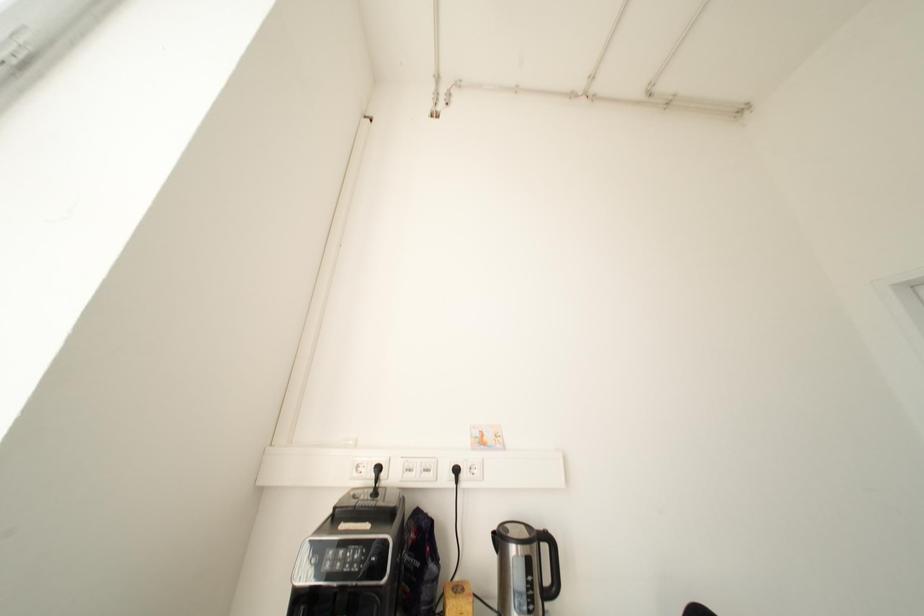
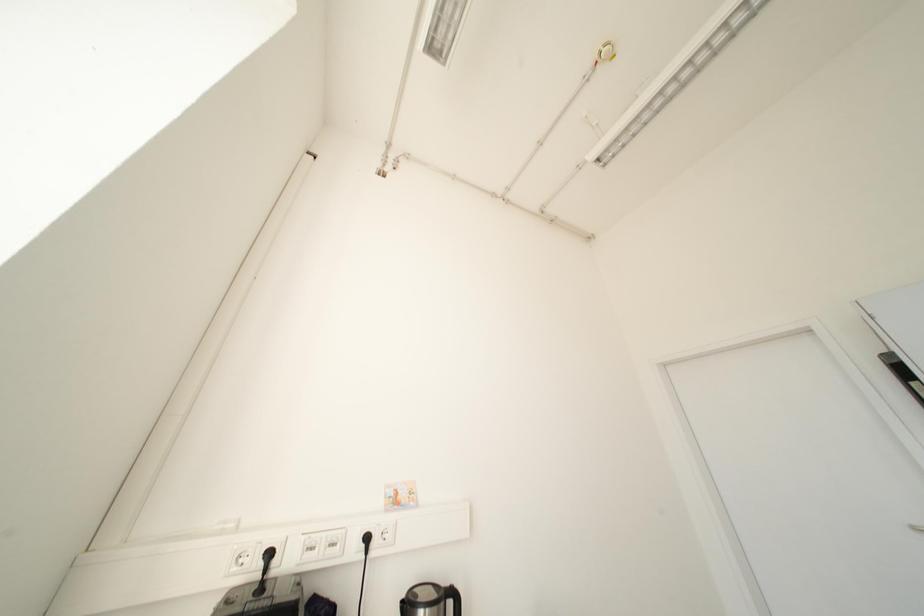
Question: Based on the continuous images, in which direction is the camera rotating? Reply with the corresponding letter.

Choices:
 (A) Left
 (B) Right
 (C) Up
 (D) Down

Answer: (B)